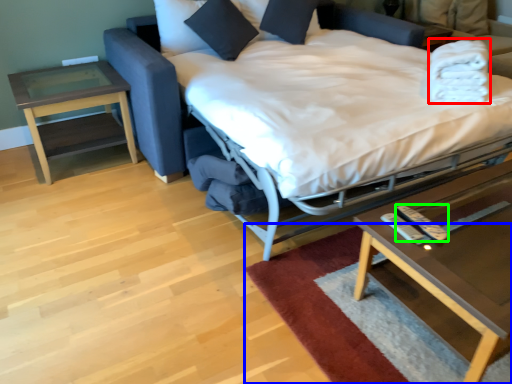
Question: Which object is positioned farthest from blanket (highlighted by a red box)? Select from mat (highlighted by a blue box) and remote (highlighted by a green box).

Choices:
 (A) mat
 (B) remote

Answer: (A)